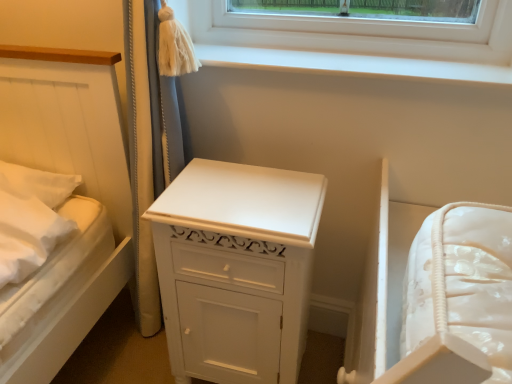
Question: Considering the positions of point (406, 77) and point (201, 192), is point (406, 77) closer or farther from the camera than point (201, 192)?

Choices:
 (A) farther
 (B) closer

Answer: (A)

Question: Is white smooth window sill at upper center to the left or to the right of white painted wood chest of drawers at center in the image?

Choices:
 (A) right
 (B) left

Answer: (A)

Question: From a real-world perspective, relative to white painted wood chest of drawers at center, is white smooth window sill at upper center vertically above or below?

Choices:
 (A) below
 (B) above

Answer: (B)

Question: Based on their positions, is white painted wood chest of drawers at center located to the left or right of white smooth window sill at upper center?

Choices:
 (A) right
 (B) left

Answer: (B)

Question: In the image, is white painted wood chest of drawers at center positioned in front of or behind white smooth window sill at upper center?

Choices:
 (A) front
 (B) behind

Answer: (A)

Question: Is white painted wood chest of drawers at center wider or thinner than white smooth window sill at upper center?

Choices:
 (A) thin
 (B) wide

Answer: (B)

Question: From the image's perspective, is white painted wood chest of drawers at center located above or below white smooth window sill at upper center?

Choices:
 (A) below
 (B) above

Answer: (A)